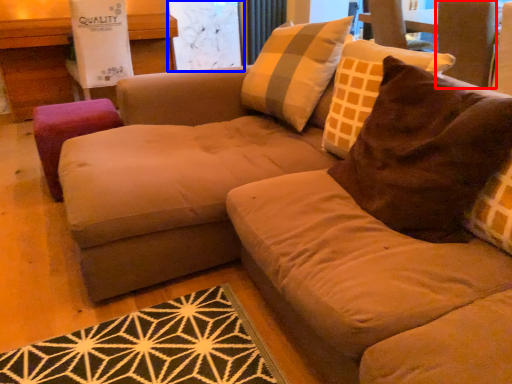
Question: Which point is closer to the camera, swivel chair (highlighted by a red box) or screen door (highlighted by a blue box)?

Choices:
 (A) swivel chair
 (B) screen door

Answer: (A)